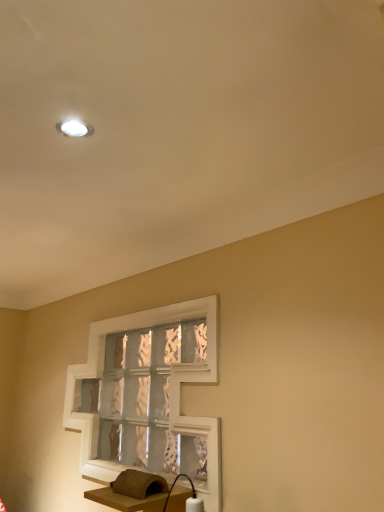
The width and height of the screenshot is (384, 512). Describe the element at coordinates (148, 397) in the screenshot. I see `clear glass window at center` at that location.

You are a GUI agent. You are given a task and a screenshot of the screen. Output one action in this format:
    pyautogui.click(x=<x>, y=<y>)
    Task: Click on the clear glass window at center
    
    Given the screenshot: What is the action you would take?
    pyautogui.click(x=148, y=397)

Image resolution: width=384 pixels, height=512 pixels. I want to click on clear glass window at center, so click(x=148, y=397).